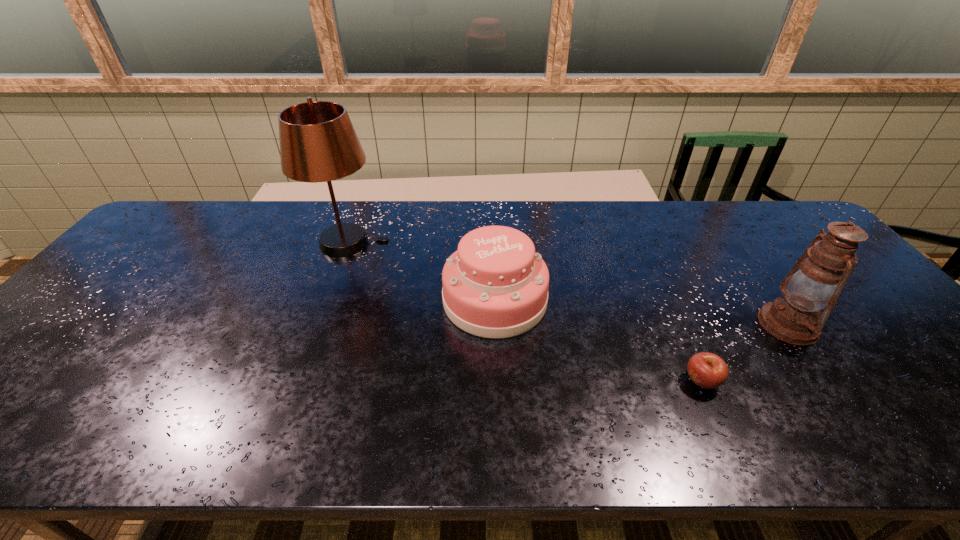
The image size is (960, 540). I want to click on vacant region that satisfies the following two spatial constraints: 1. on the front side of the birthday cake; 2. on the left side of the rightmost object, so click(495, 325).

The width and height of the screenshot is (960, 540). I want to click on free region that satisfies the following two spatial constraints: 1. on the front-facing side of the third tallest object; 2. on the right side of the leftmost object, so click(x=326, y=300).

Find the location of `vacant region that satisfies the following two spatial constraints: 1. on the front-facing side of the lampshade; 2. on the left side of the third shortest object`. vacant region that satisfies the following two spatial constraints: 1. on the front-facing side of the lampshade; 2. on the left side of the third shortest object is located at coordinates (317, 325).

The width and height of the screenshot is (960, 540). I want to click on free space that satisfies the following two spatial constraints: 1. on the front-facing side of the second tallest object; 2. on the left side of the leftmost object, so click(x=317, y=325).